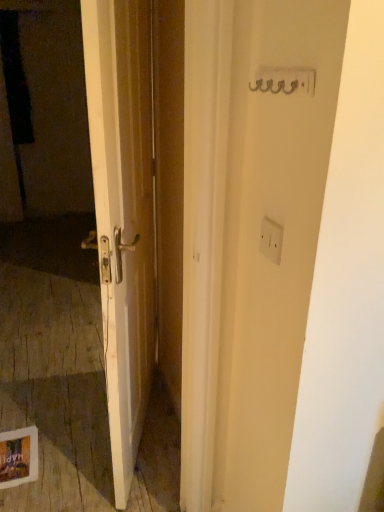
Question: Is transparent plastic screen door at left spatially inside white plastic electric outlet at upper right, or outside of it?

Choices:
 (A) inside
 (B) outside

Answer: (B)

Question: Is transparent plastic screen door at left to the left or to the right of white plastic electric outlet at upper right in the image?

Choices:
 (A) left
 (B) right

Answer: (A)

Question: From the image's perspective, is transparent plastic screen door at left positioned above or below white plastic electric outlet at upper right?

Choices:
 (A) below
 (B) above

Answer: (B)

Question: In terms of size, does white plastic electric outlet at upper right appear bigger or smaller than transparent plastic screen door at left?

Choices:
 (A) small
 (B) big

Answer: (A)

Question: Is white plastic electric outlet at upper right wider or thinner than transparent plastic screen door at left?

Choices:
 (A) thin
 (B) wide

Answer: (A)

Question: Is white plastic electric outlet at upper right spatially inside transparent plastic screen door at left, or outside of it?

Choices:
 (A) inside
 (B) outside

Answer: (B)

Question: From the image's perspective, is white plastic electric outlet at upper right located above or below transparent plastic screen door at left?

Choices:
 (A) above
 (B) below

Answer: (B)